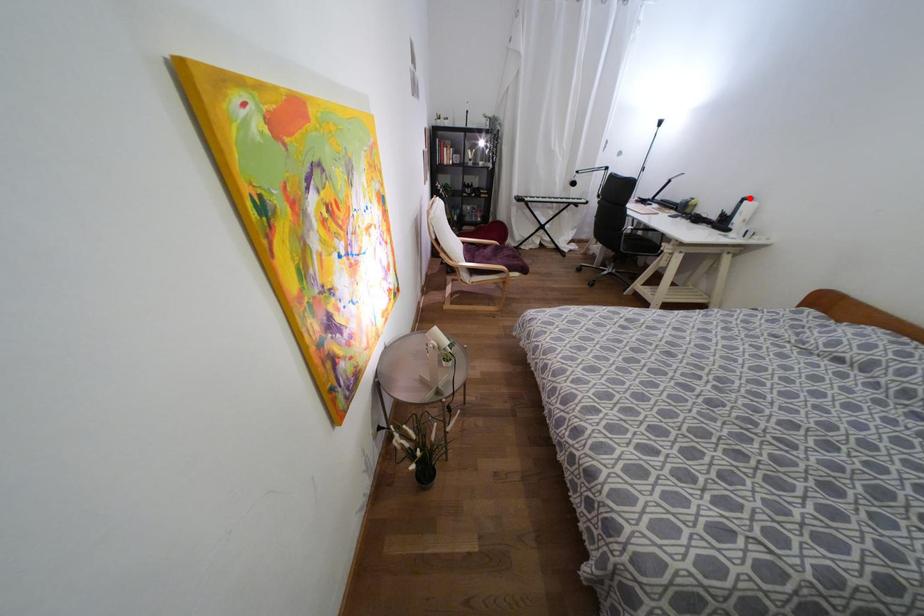
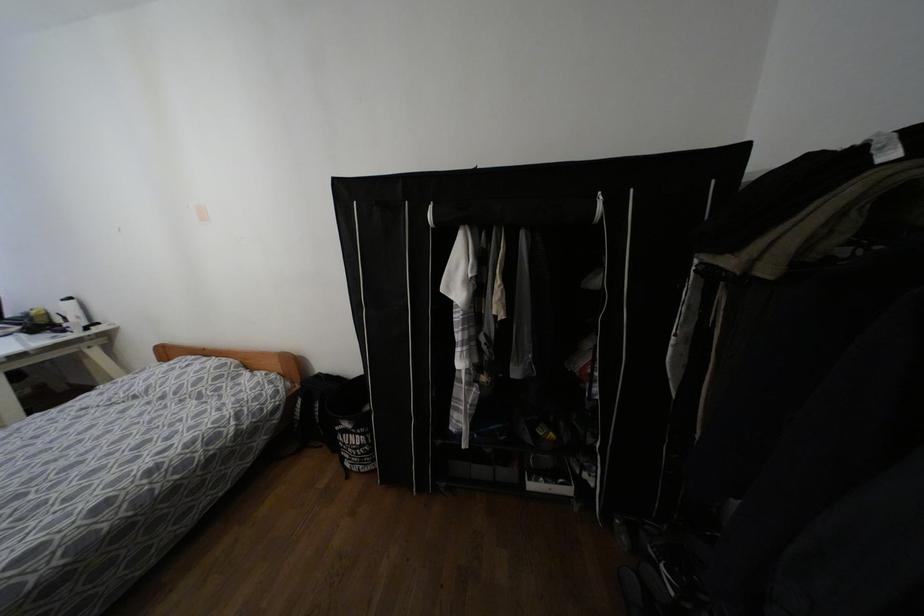
The point at the highlighted location is marked in the first image. Where is the corresponding point in the second image?

(68, 299)